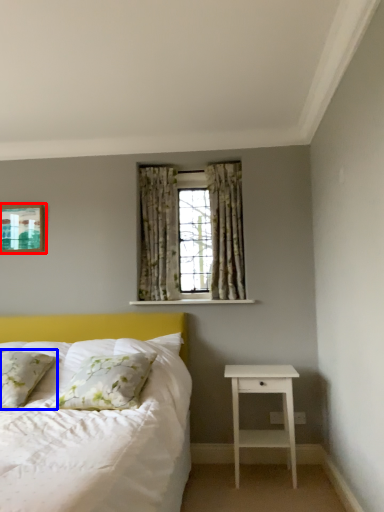
Question: Among these objects, which one is nearest to the camera, picture frame (highlighted by a red box) or pillow (highlighted by a blue box)?

Choices:
 (A) picture frame
 (B) pillow

Answer: (B)